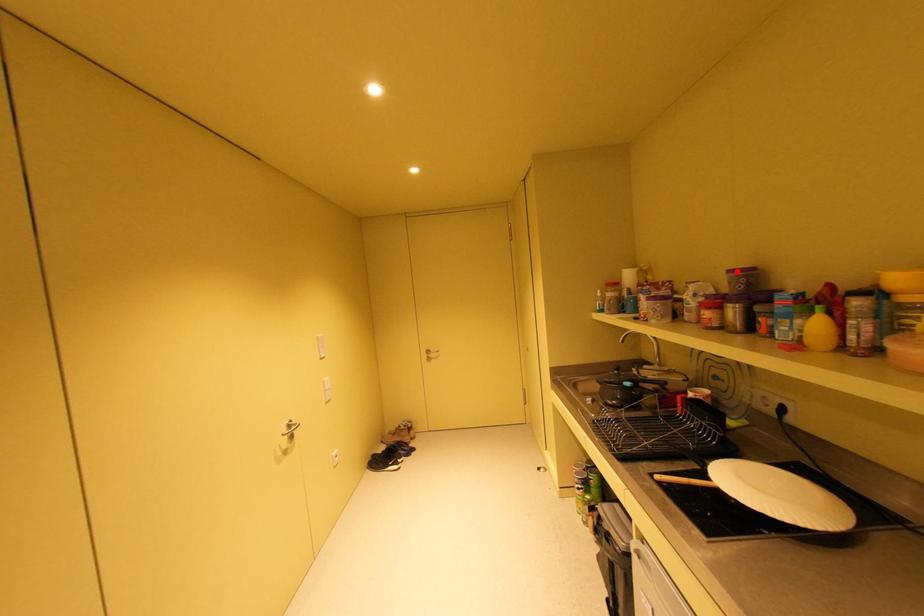
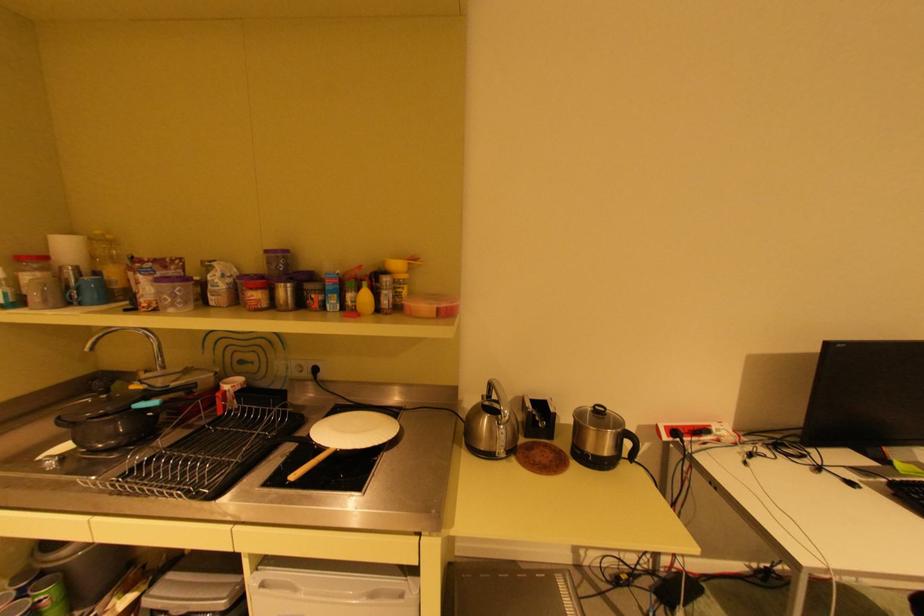
Where in the second image is the point corresponding to the highlighted location from the first image?

(274, 251)